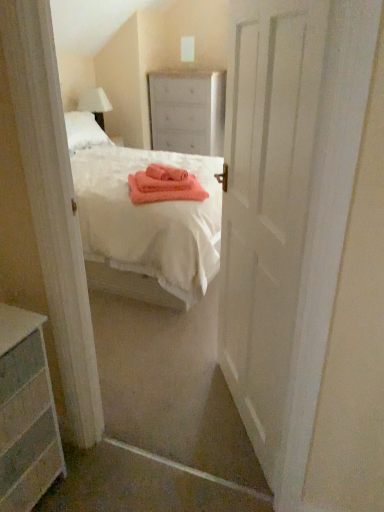
Question: Is white fabric lampshade at upper left positioned before white wood dresser at upper center?

Choices:
 (A) no
 (B) yes

Answer: (B)

Question: From a real-world perspective, is white fabric lampshade at upper left located beneath white wood dresser at upper center?

Choices:
 (A) no
 (B) yes

Answer: (A)

Question: Is white fabric lampshade at upper left completely or partially outside of white wood dresser at upper center?

Choices:
 (A) yes
 (B) no

Answer: (A)

Question: Is white fabric lampshade at upper left wider than white wood dresser at upper center?

Choices:
 (A) yes
 (B) no

Answer: (B)

Question: Is white wood dresser at upper center located within white fabric lampshade at upper left?

Choices:
 (A) no
 (B) yes

Answer: (A)

Question: In terms of height, does gray striped dresser at lower left look taller or shorter compared to white matte door at center?

Choices:
 (A) short
 (B) tall

Answer: (A)

Question: Based on their sizes in the image, would you say gray striped dresser at lower left is bigger or smaller than white matte door at center?

Choices:
 (A) small
 (B) big

Answer: (A)

Question: From a real-world perspective, is gray striped dresser at lower left positioned above or below white matte door at center?

Choices:
 (A) above
 (B) below

Answer: (B)

Question: In terms of width, does gray striped dresser at lower left look wider or thinner when compared to white matte door at center?

Choices:
 (A) thin
 (B) wide

Answer: (B)

Question: From a real-world perspective, is white matte door at center physically located above or below gray striped dresser at lower left?

Choices:
 (A) above
 (B) below

Answer: (A)

Question: In terms of height, does white matte door at center look taller or shorter compared to gray striped dresser at lower left?

Choices:
 (A) short
 (B) tall

Answer: (B)

Question: Do you think white matte door at center is within gray striped dresser at lower left, or outside of it?

Choices:
 (A) inside
 (B) outside

Answer: (B)

Question: In terms of size, does white matte door at center appear bigger or smaller than gray striped dresser at lower left?

Choices:
 (A) big
 (B) small

Answer: (A)

Question: In terms of height, does gray striped dresser at lower left look taller or shorter compared to white fabric lampshade at upper left?

Choices:
 (A) short
 (B) tall

Answer: (B)

Question: Is gray striped dresser at lower left bigger or smaller than white fabric lampshade at upper left?

Choices:
 (A) big
 (B) small

Answer: (A)